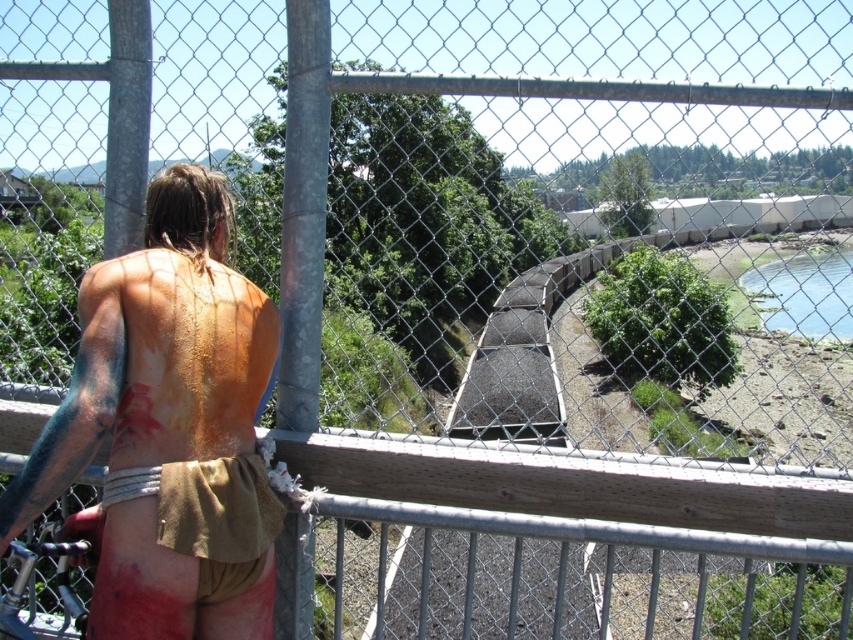
You are a photographer trying to capture a clear shot of the person through the fence. The brown leather shorts at left and the green grassy river at lower right are in your viewfinder. Which object appears smaller in the photo?

The brown leather shorts at left appears smaller in the photo because it has a lesser height compared to the green grassy river at lower right.

You are standing in front of a chain link fence with a wooden railing in the middle. You see a point at coordinates (199, 282). Is this point closer to you than the wooden railing?

The point at coordinates (199, 282) is 14.96 feet away from the viewer. Since the wooden railing is in the middle of the frame, it is likely closer than the point. Therefore, the point is farther away than the wooden railing.

From the picture: You are a photographer trying to capture the scene through the fence. You notice the brown leather shorts at left and the green grassy river at lower right. Which object takes up more space in the photo?

The green grassy river at lower right takes up more space in the photo because the brown leather shorts at left has a smaller size compared to it.